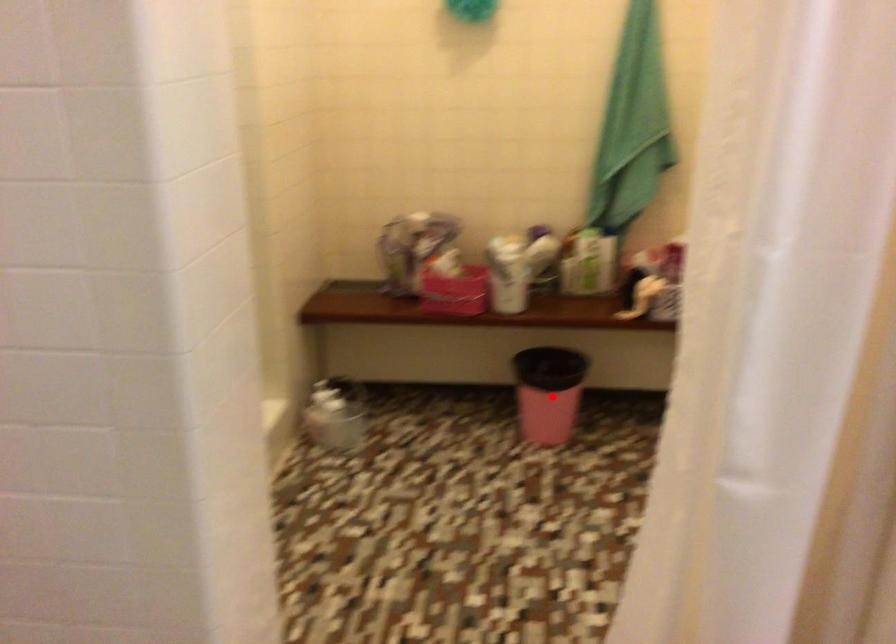
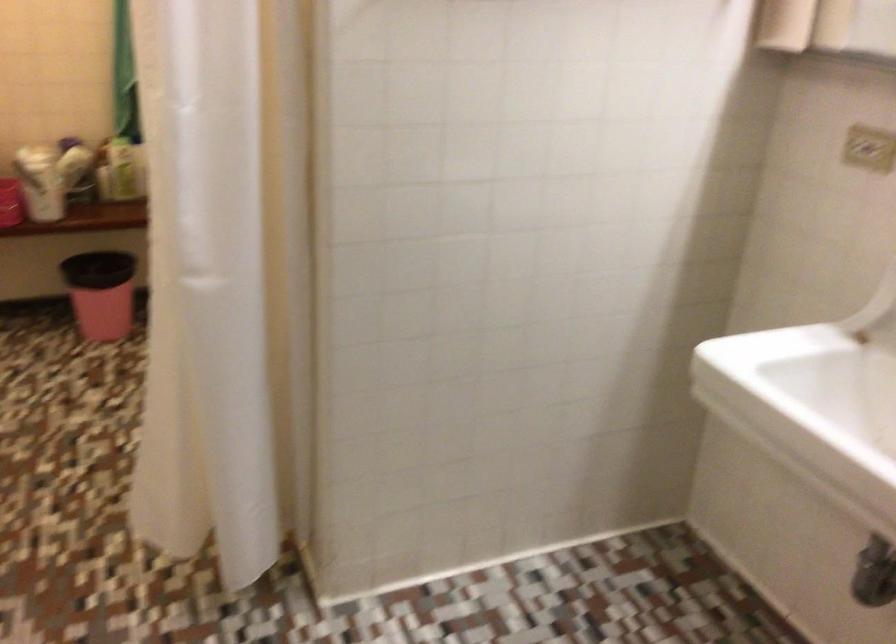
The point at the highlighted location is marked in the first image. Where is the corresponding point in the second image?

(100, 292)